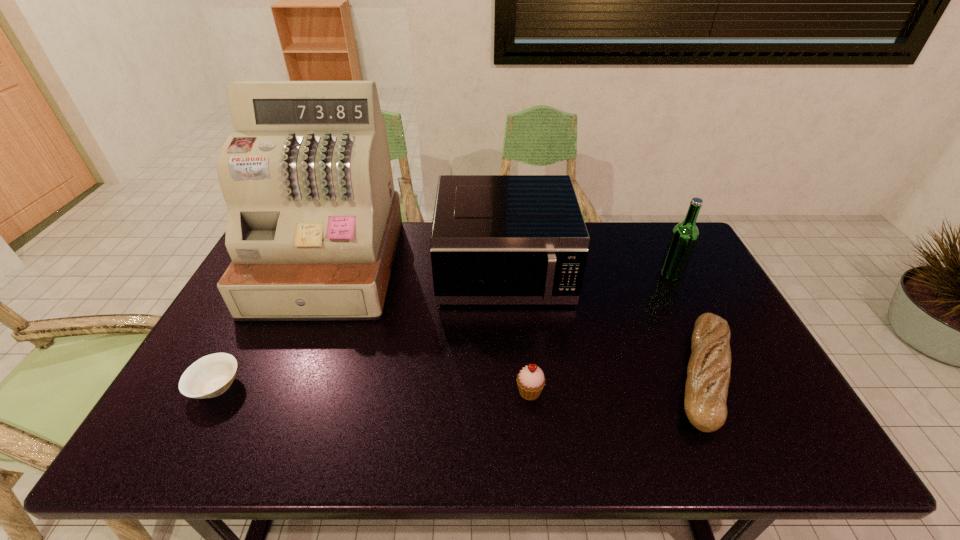
The height and width of the screenshot is (540, 960). I want to click on vacant space in between the microwave_oven and the shortest object, so click(x=360, y=331).

In order to click on vacant space that's between the second shortest object and the cash register in this screenshot , I will do `click(516, 320)`.

In order to click on empty location between the baguet and the beer bottle in this screenshot , I will do `click(687, 325)`.

At what (x,y) coordinates should I click in order to perform the action: click on vacant area that lies between the shortest object and the fifth tallest object. Please return your answer as a coordinate pair (x, y). Looking at the image, I should click on (460, 381).

I want to click on free space between the microwave_oven and the fourth tallest object, so click(x=516, y=333).

Select which object is the fifth closest to the shortest object. Please provide its 2D coordinates. Your answer should be formatted as a tuple, i.e. [(x, y)], where the tuple contains the x and y coordinates of a point satisfying the conditions above.

[(684, 236)]

Locate which object ranks in proximity to the microwave_oven. Please provide its 2D coordinates. Your answer should be formatted as a tuple, i.e. [(x, y)], where the tuple contains the x and y coordinates of a point satisfying the conditions above.

[(313, 223)]

The image size is (960, 540). In order to click on vacant space that satisfies the following two spatial constraints: 1. on the back side of the shortest object; 2. on the left side of the baguet in this screenshot , I will do `click(223, 375)`.